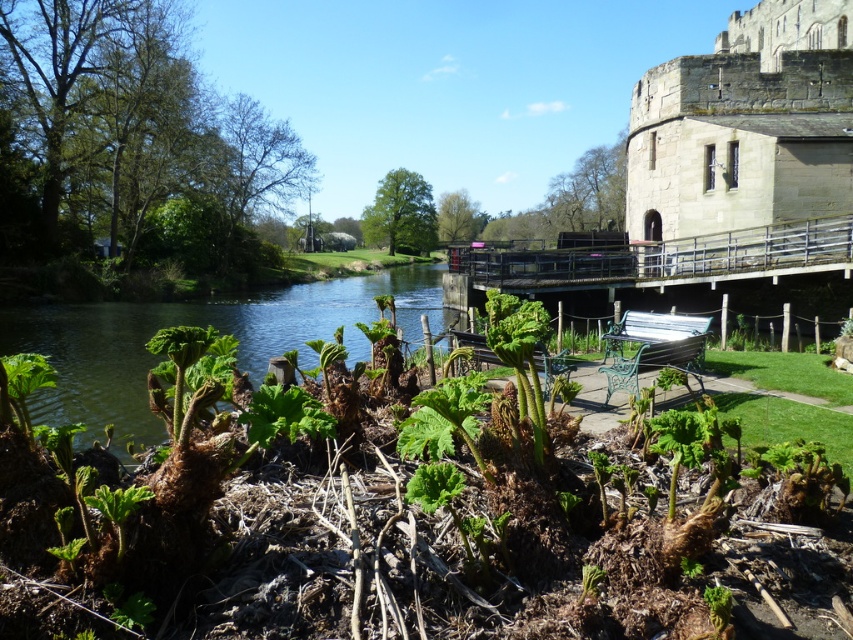
Can you confirm if gray stone castle at upper right is taller than green leafy plants at center?

Yes, gray stone castle at upper right is taller than green leafy plants at center.

Is the position of gray stone castle at upper right less distant than that of green leafy plants at center?

No, gray stone castle at upper right is further to the viewer.

Where is `gray stone castle at upper right`? The image size is (853, 640). gray stone castle at upper right is located at coordinates (746, 125).